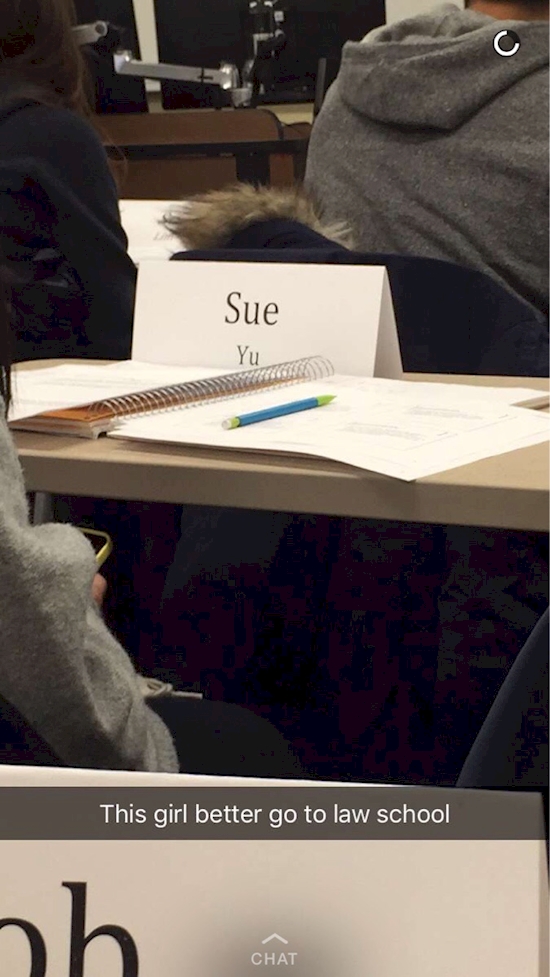
Locate an element on the screen. The width and height of the screenshot is (550, 977). ring binder is located at coordinates (180, 398).